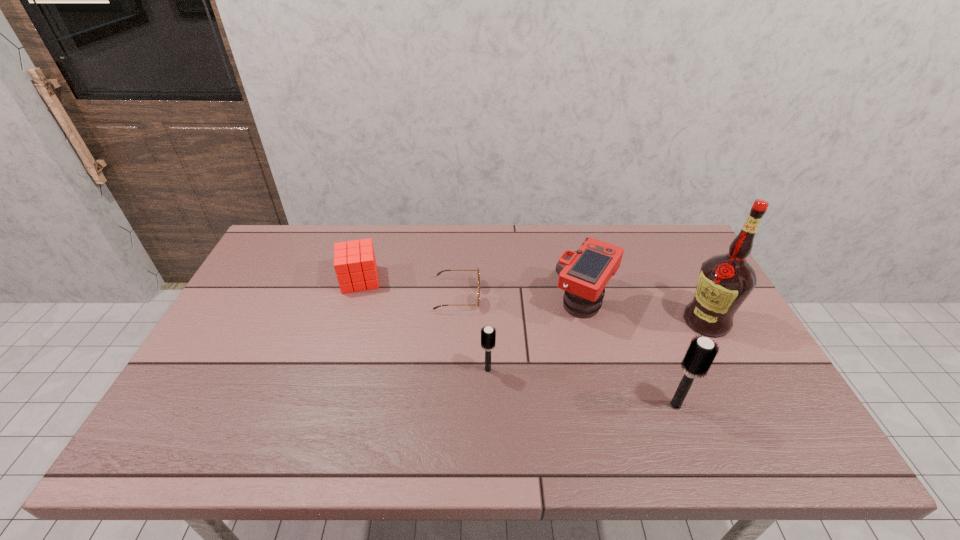
Find the location of `the shorter hairbrush`. the shorter hairbrush is located at coordinates (487, 334).

The width and height of the screenshot is (960, 540). Identify the location of the fifth farthest object. (487, 334).

Where is `the fifth shortest object`? The height and width of the screenshot is (540, 960). the fifth shortest object is located at coordinates (701, 352).

Identify the location of the taller hairbrush. (701, 352).

You are a GUI agent. You are given a task and a screenshot of the screen. Output one action in this format:
    pyautogui.click(x=<x>, y=<y>)
    Task: Click on the shortest object
    
    Given the screenshot: What is the action you would take?
    pyautogui.click(x=478, y=300)

Identify the location of camera. (583, 274).

Where is `the rightmost object`? the rightmost object is located at coordinates (725, 281).

Find the location of a particular element. alcohol is located at coordinates tap(725, 281).

Where is `cube`? This screenshot has height=540, width=960. cube is located at coordinates (355, 265).

Find the location of `the leftmost object`. the leftmost object is located at coordinates (355, 265).